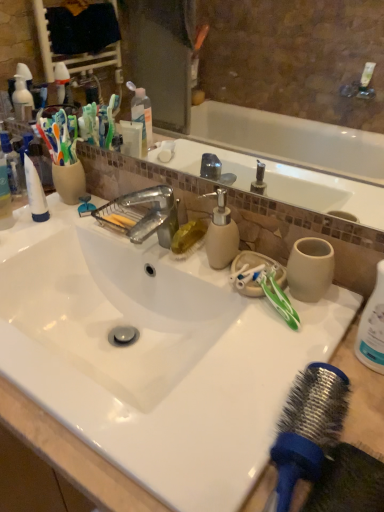
I want to click on unoccupied area in front of beige matte soap dispenser at center, so click(240, 331).